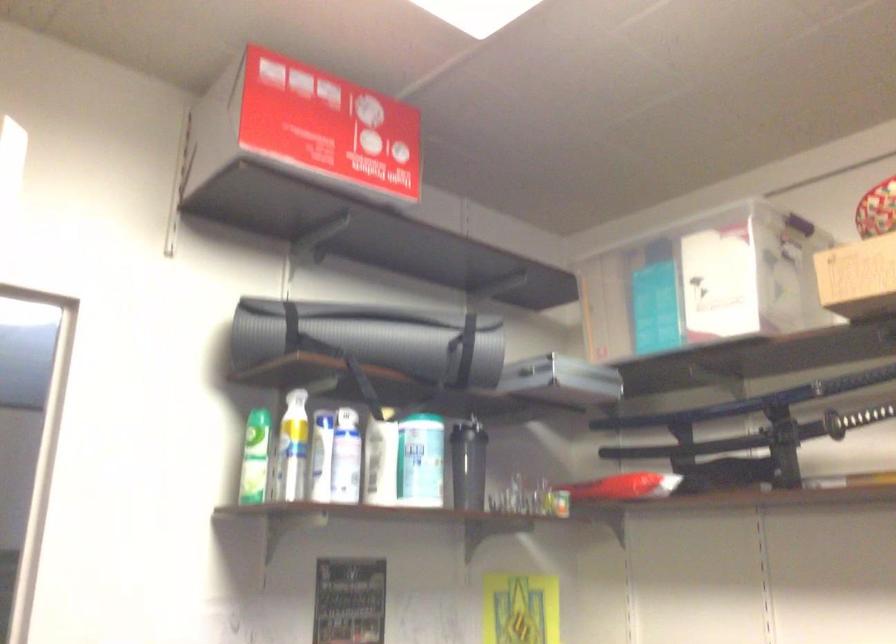
Where is `red cardboard box`? red cardboard box is located at coordinates (328, 125).